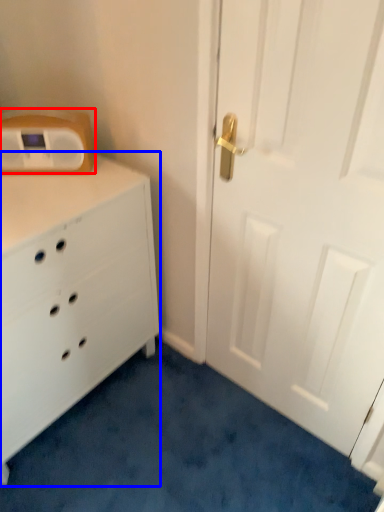
Question: Which object is closer to the camera taking this photo, appliance (highlighted by a red box) or chest of drawers (highlighted by a blue box)?

Choices:
 (A) appliance
 (B) chest of drawers

Answer: (B)